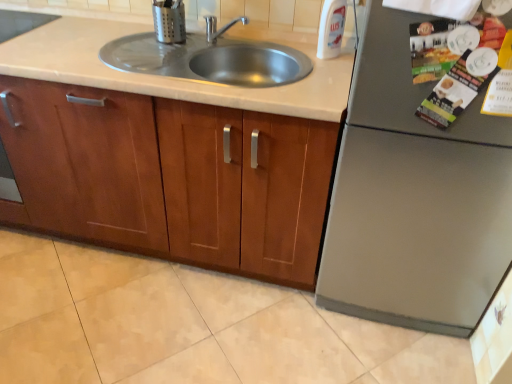
Question: In terms of height, does white plastic bottle at upper right look taller or shorter compared to wooden cabinet at center?

Choices:
 (A) short
 (B) tall

Answer: (A)

Question: Looking at the image, does white plastic bottle at upper right seem bigger or smaller compared to wooden cabinet at center?

Choices:
 (A) big
 (B) small

Answer: (B)

Question: Estimate the real-world distances between objects in this image. Which object is farther from the brushed metal utensil holder at upper center, which ranks as the 1th appliance in left-to-right order?

Choices:
 (A) satin silver refrigerator at right, marked as the second appliance in a left-to-right arrangement
 (B) wooden cabinet at center
 (C) white plastic bottle at upper right
 (D) beige tile floor at lower center
 (E) stainless steel sink at center

Answer: (D)

Question: Estimate the real-world distances between objects in this image. Which object is farther from the brushed metal utensil holder at upper center, which ranks as the 1th appliance in left-to-right order?

Choices:
 (A) beige tile floor at lower center
 (B) stainless steel sink at center
 (C) satin silver refrigerator at right, positioned as the first appliance in bottom-to-top order
 (D) white plastic bottle at upper right
 (E) matte plastic magazine at upper right

Answer: (A)